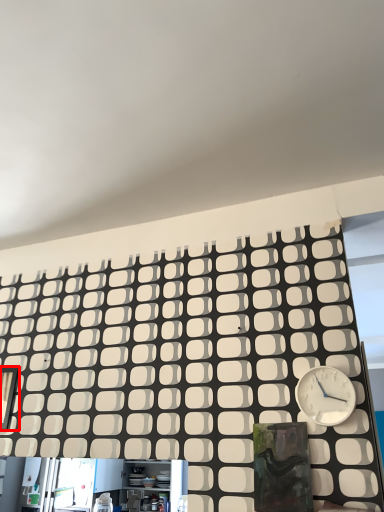
Question: Considering the relative positions of window (annotated by the red box) and wall clock in the image provided, where is window (annotated by the red box) located with respect to the staircase?

Choices:
 (A) left
 (B) right

Answer: (A)